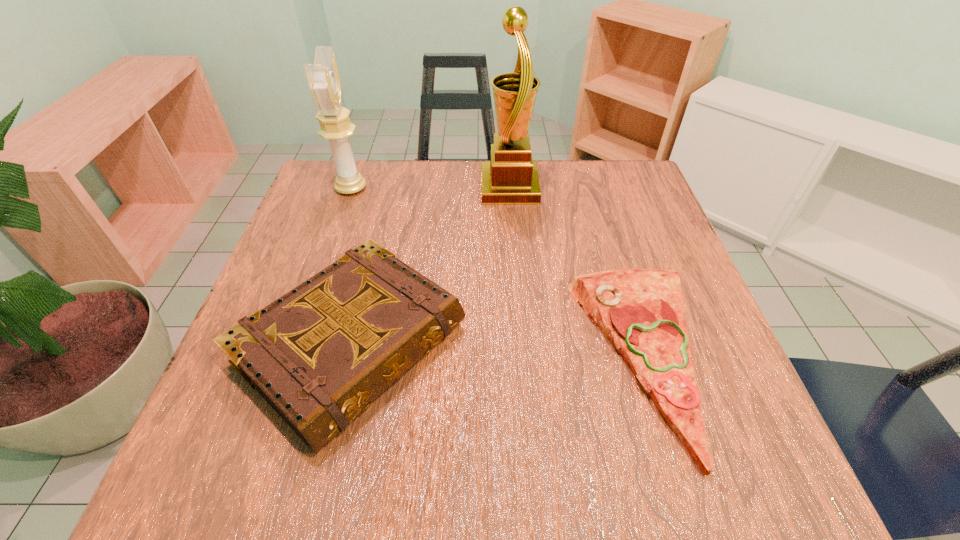
At what (x,y) coordinates should I click in order to perform the action: click on vacant space that satisfies the following two spatial constraints: 1. on the front-facing side of the hardback book; 2. on the left side of the left award. Please return your answer as a coordinate pair (x, y). Looking at the image, I should click on (297, 345).

Find the location of a particular element. free space that satisfies the following two spatial constraints: 1. on the front-facing side of the shortest object; 2. on the right side of the third shortest object is located at coordinates (292, 358).

Where is `vacant position in the image that satisfies the following two spatial constraints: 1. on the back side of the hardback book; 2. on the front-facing side of the shorter award`? The height and width of the screenshot is (540, 960). vacant position in the image that satisfies the following two spatial constraints: 1. on the back side of the hardback book; 2. on the front-facing side of the shorter award is located at coordinates (391, 188).

Locate an element on the screen. This screenshot has height=540, width=960. free spot that satisfies the following two spatial constraints: 1. on the front side of the pizza; 2. on the left side of the third tallest object is located at coordinates (349, 358).

What are the coordinates of `free space that satisfies the following two spatial constraints: 1. on the back side of the shortest object; 2. on the front-facing side of the tallest object` in the screenshot? It's located at (591, 188).

You are a GUI agent. You are given a task and a screenshot of the screen. Output one action in this format:
    pyautogui.click(x=<x>, y=<y>)
    Task: Click on the vacant space that satisfies the following two spatial constraints: 1. on the front-facing side of the pizza; 2. on the right side of the third shortest object
    This screenshot has height=540, width=960.
    Given the screenshot: What is the action you would take?
    pyautogui.click(x=292, y=358)

This screenshot has height=540, width=960. Identify the location of blank area in the image that satisfies the following two spatial constraints: 1. on the front-facing side of the right award; 2. on the right side of the shortest object. (523, 358).

The height and width of the screenshot is (540, 960). Find the location of `free location that satisfies the following two spatial constraints: 1. on the back side of the pizza; 2. on the front-facing side of the right award`. free location that satisfies the following two spatial constraints: 1. on the back side of the pizza; 2. on the front-facing side of the right award is located at coordinates (591, 188).